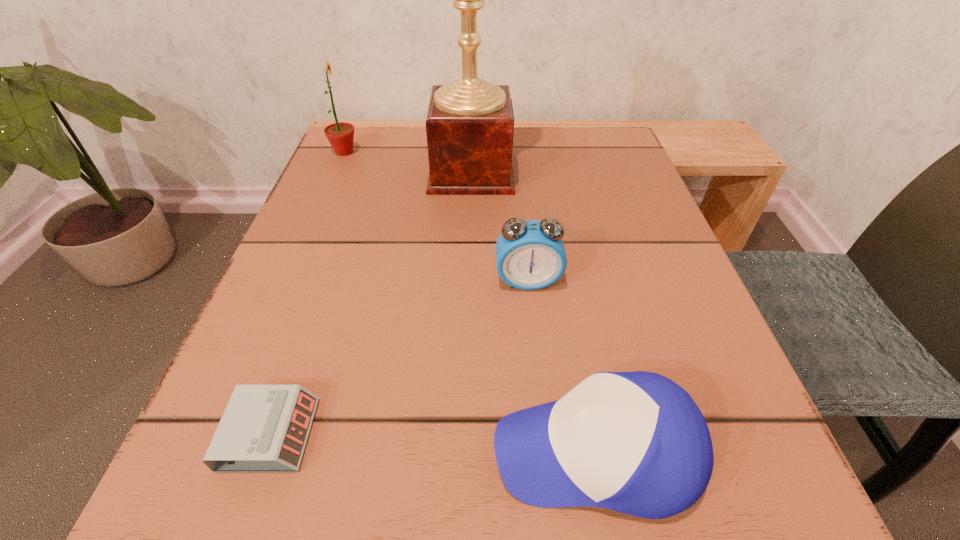
The image size is (960, 540). What are the coordinates of `object that is positioned at the right edge` in the screenshot? It's located at (635, 442).

Locate an element on the screen. Image resolution: width=960 pixels, height=540 pixels. object located in the far left corner section of the desktop is located at coordinates (340, 135).

Locate an element on the screen. This screenshot has width=960, height=540. object located in the near left corner section of the desktop is located at coordinates (264, 429).

Where is `object present at the near right corner`? Image resolution: width=960 pixels, height=540 pixels. object present at the near right corner is located at coordinates (635, 442).

Locate an element on the screen. vacant space at the far edge of the desktop is located at coordinates (541, 166).

This screenshot has height=540, width=960. I want to click on free space at the left edge of the desktop, so click(x=366, y=288).

The image size is (960, 540). Identify the location of free region at the right edge of the desktop. (571, 218).

This screenshot has height=540, width=960. In order to click on vacant space at the far left corner of the desktop in this screenshot , I will do `click(341, 158)`.

In the image, there is a desktop. Where is `vacant space at the far right corner`? This screenshot has width=960, height=540. vacant space at the far right corner is located at coordinates (590, 157).

This screenshot has height=540, width=960. Identify the location of unoccupied area between the third shortest object and the sunflower. (436, 217).